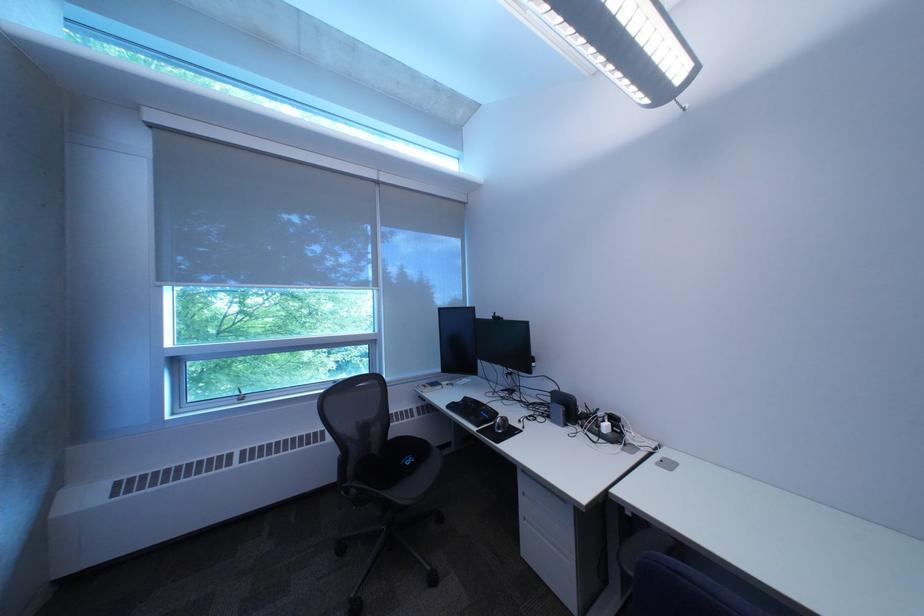
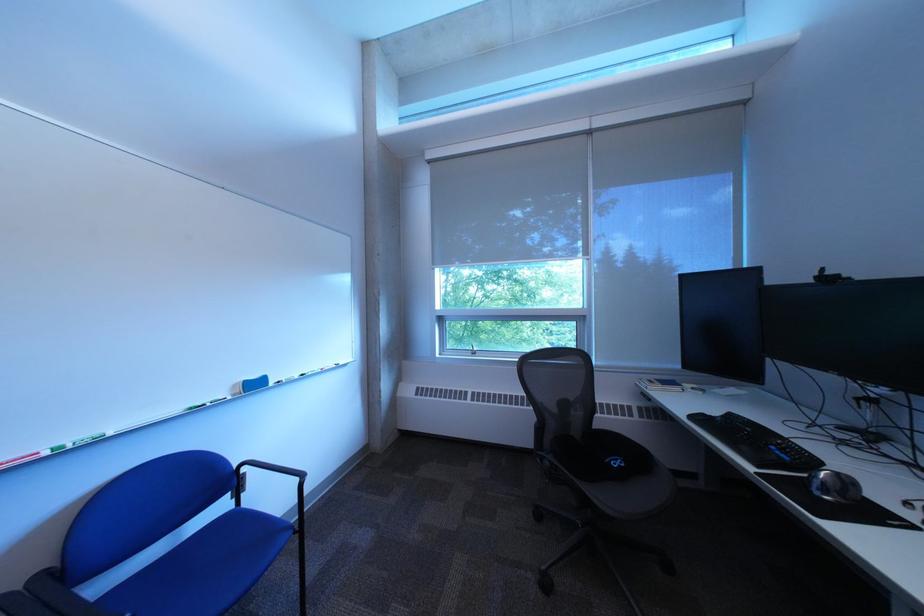
The point at (515, 430) is marked in the first image. Where is the corresponding point in the second image?

(841, 493)